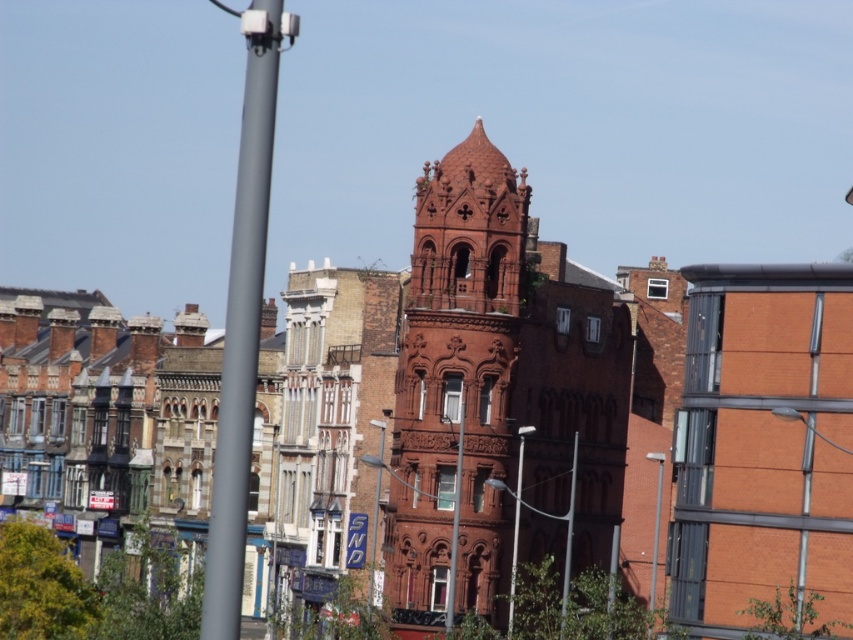
Question: Is metallic silver streetlight at center below matte metal pole at center?

Choices:
 (A) no
 (B) yes

Answer: (B)

Question: Estimate the real-world distances between objects in this image. Which object is closer to the smooth gray pole at left?

Choices:
 (A) matte brick tower at center
 (B) metallic gray streetlight at center
 (C) metallic silver streetlight at center
 (D) metallic gray pole at center

Answer: (A)

Question: Estimate the real-world distances between objects in this image. Which object is farther from the metallic gray pole at center?

Choices:
 (A) metallic silver streetlight at center
 (B) metallic gray streetlight at center
 (C) smooth gray pole at left
 (D) matte metal pole at center

Answer: (C)

Question: Which of the following is the farthest from the observer?

Choices:
 (A) (561, 618)
 (B) (511, 582)

Answer: (B)

Question: Is metallic gray streetlight at center further to the viewer compared to metallic gray pole at center?

Choices:
 (A) no
 (B) yes

Answer: (B)

Question: Does matte brick tower at center have a lesser width compared to blue plastic sign at center?

Choices:
 (A) yes
 (B) no

Answer: (B)